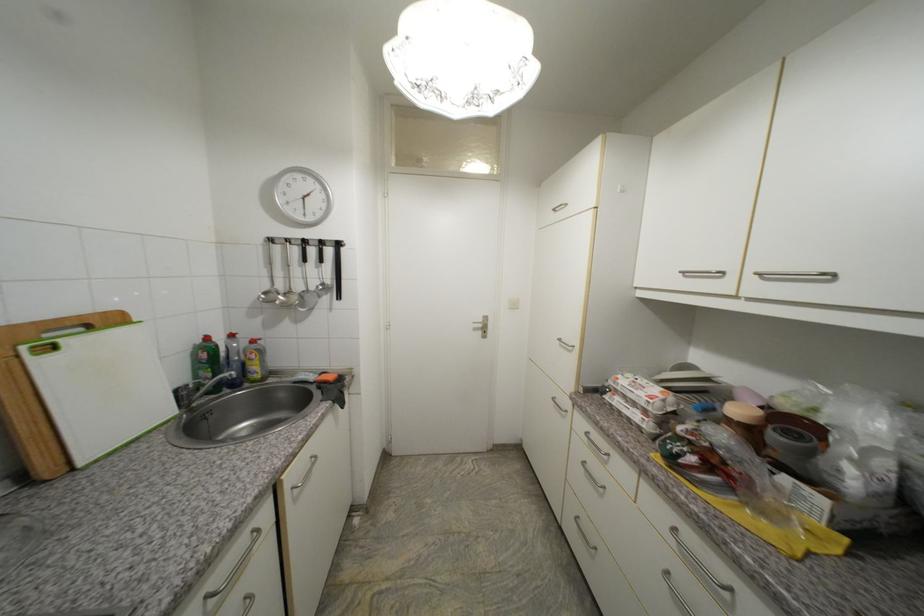
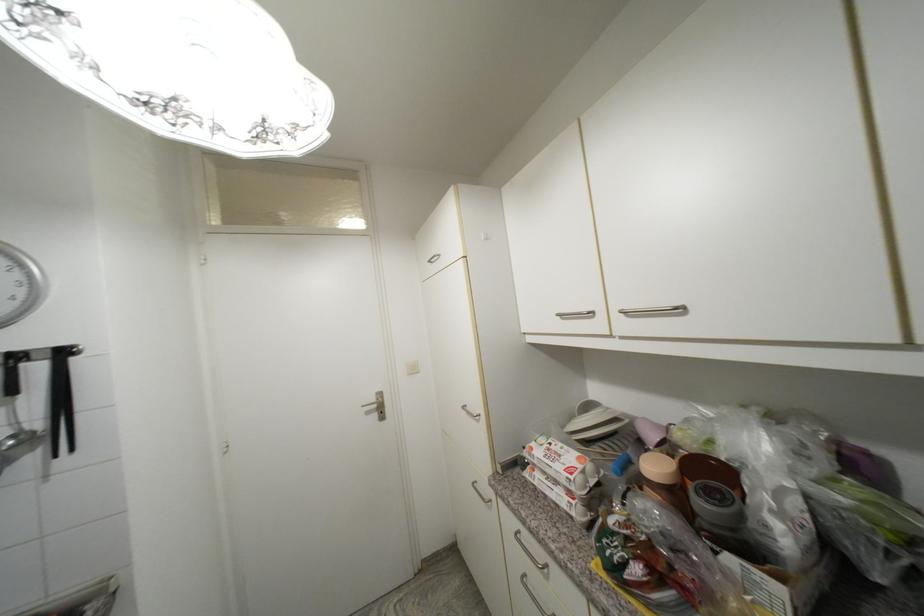
Locate, in the second image, the point that corresponds to point 746,413 in the first image.

(662, 469)